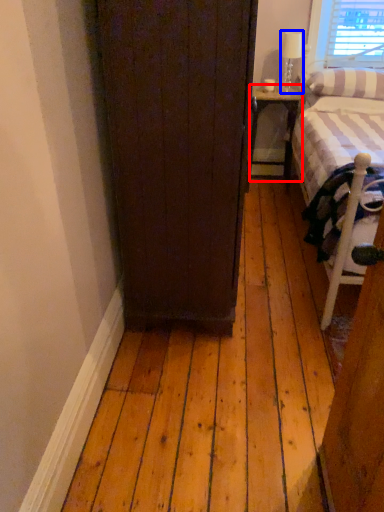
Question: Which of the following is the closest to the observer, nightstand (highlighted by a red box) or lamp (highlighted by a blue box)?

Choices:
 (A) nightstand
 (B) lamp

Answer: (B)